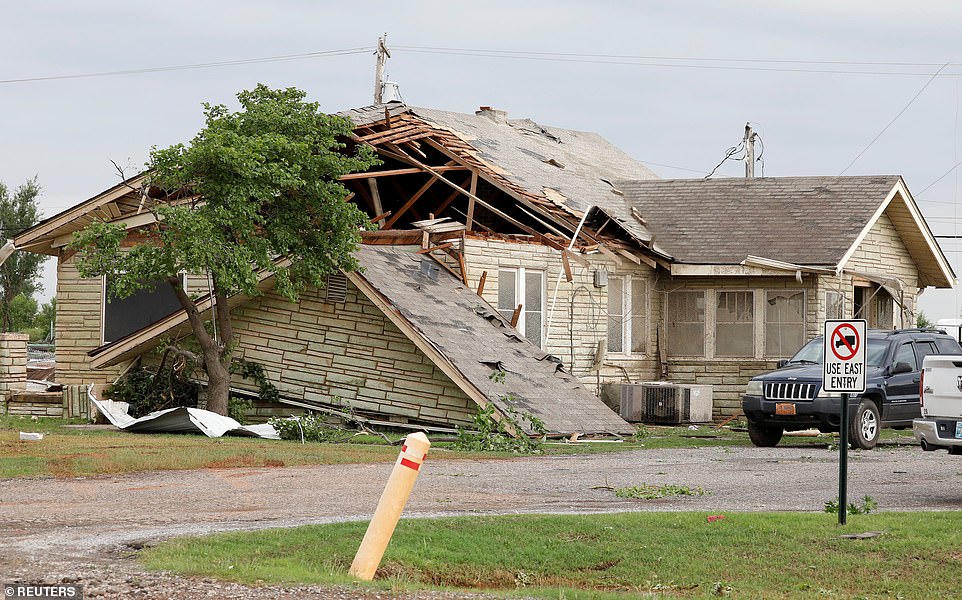
Locate an element on the screen. doorway is located at coordinates (859, 300).